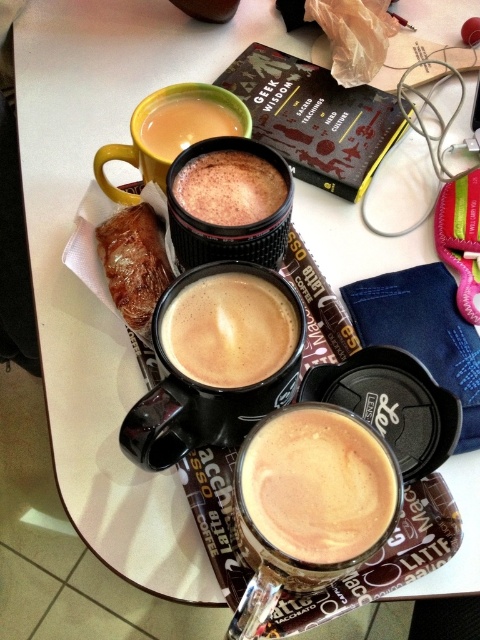
You are a barista trying to arrange the cups on a shelf. The shelf has a width limit of 10 inches. If the cappuccino foam at center and the yellow matte mug at upper left are placed side by side, will they exceed the shelf width?

The cappuccino foam at center has a lesser width compared to the yellow matte mug at upper left. However, without knowing the exact widths of both items, it is impossible to determine if their combined width exceeds 10 inches. Additional measurements are needed.

You are a customer at the cafe and want to pick up the cup closest to you. The cups are labeled with coordinates as point (x=303, y=497) and point (x=180, y=112). Which coordinate should you reach for?

Point (x=303, y=497) is closer to the camera than point (x=180, y=112), so you should reach for the cup at point (x=303, y=497).

You are a barista trying to determine which cup has the thicker foam. You see the cappuccino foam at center and the black matte cup at center. Which one has thicker foam?

The black matte cup at center has thicker foam than the cappuccino foam at center.